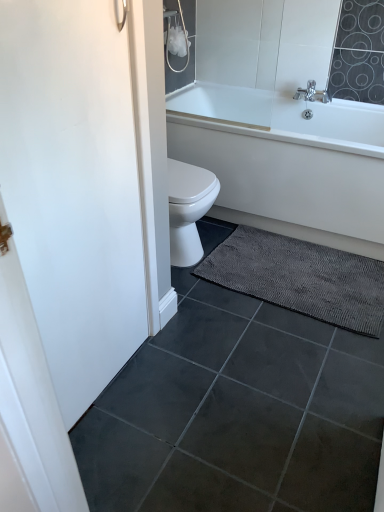
This screenshot has height=512, width=384. What are the coordinates of `white glossy bathtub at upper right` in the screenshot? It's located at 287,162.

What do you see at coordinates (287, 162) in the screenshot? I see `white glossy bathtub at upper right` at bounding box center [287, 162].

The width and height of the screenshot is (384, 512). Find the location of `white glossy bathtub at upper right`. white glossy bathtub at upper right is located at coordinates (287, 162).